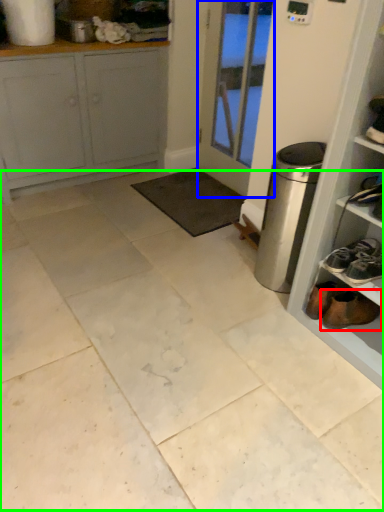
Question: Which is nearer to the footwear (highlighted by a red box)? door (highlighted by a blue box) or ceramic tile (highlighted by a green box).

Choices:
 (A) door
 (B) ceramic tile

Answer: (B)